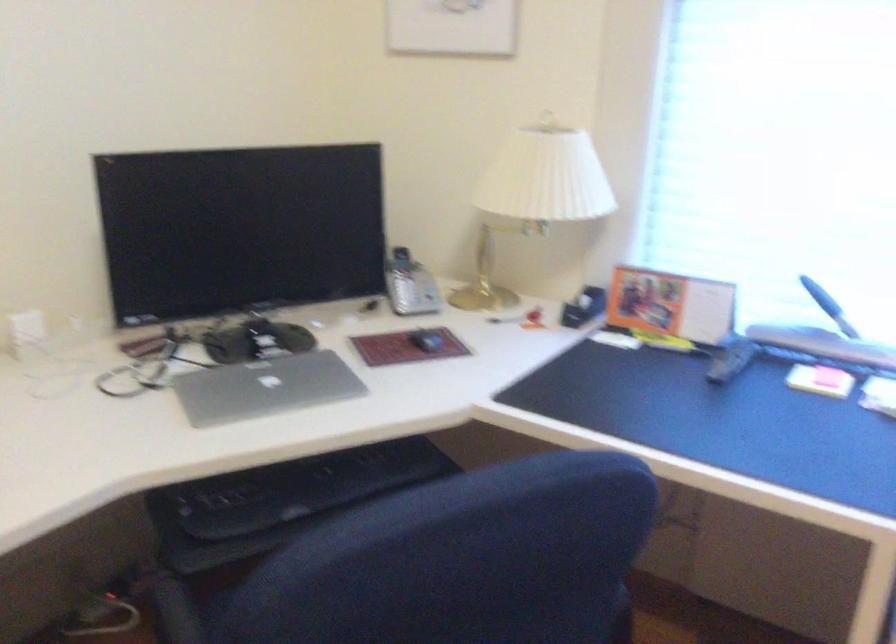
The image size is (896, 644). Describe the element at coordinates (829, 377) in the screenshot. I see `the pink sticky note pad` at that location.